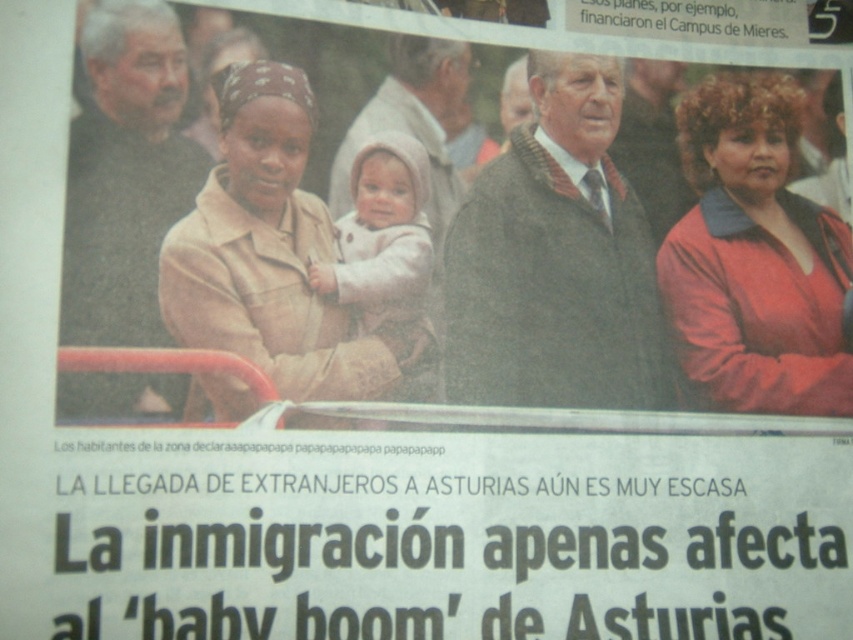
Consider the image. What is the relationship between the size of the beige fabric jacket at center and the light beige fabric baby at center in the image?

The beige fabric jacket at center is larger in size than the light beige fabric baby at center.

You are a photographer reviewing this image. You notice the matte red sweater at right and the light beige fabric baby at center. Which object is closer to the camera lens?

The matte red sweater at right is closer to the camera lens because it is further to the viewer than the light beige fabric baby at center.